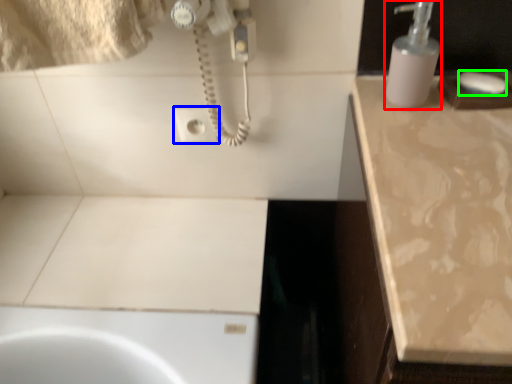
Question: Based on their relative distances, which object is farther from soap dispenser (highlighted by a red box)? Choose from electric outlet (highlighted by a blue box) and soap (highlighted by a green box).

Choices:
 (A) electric outlet
 (B) soap

Answer: (A)